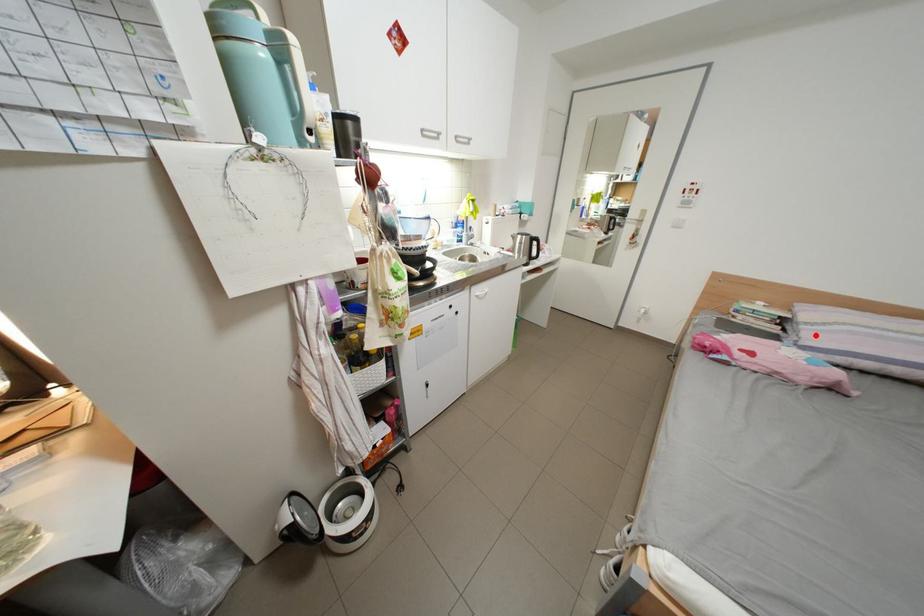
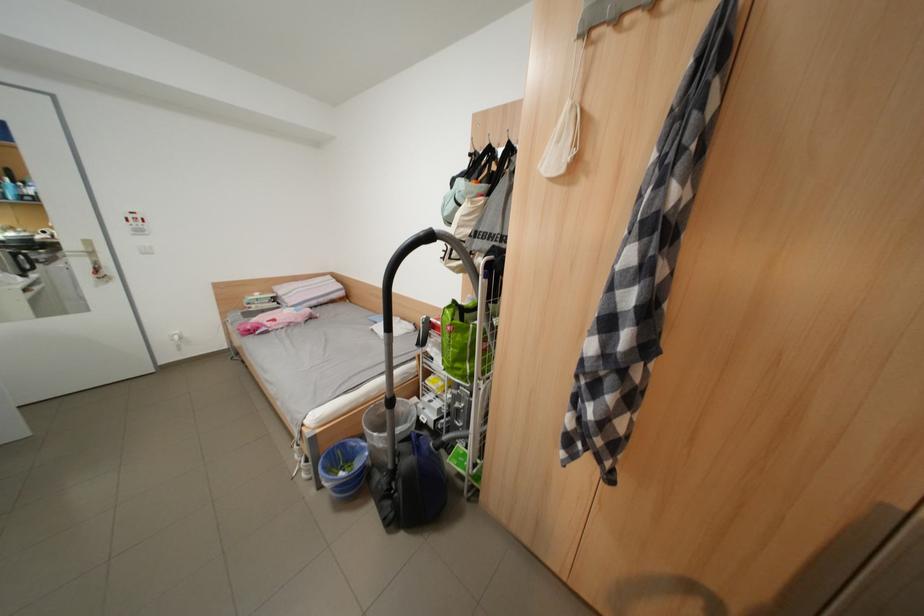
In the second image, find the point that corresponds to the highlighted location in the first image.

(298, 302)